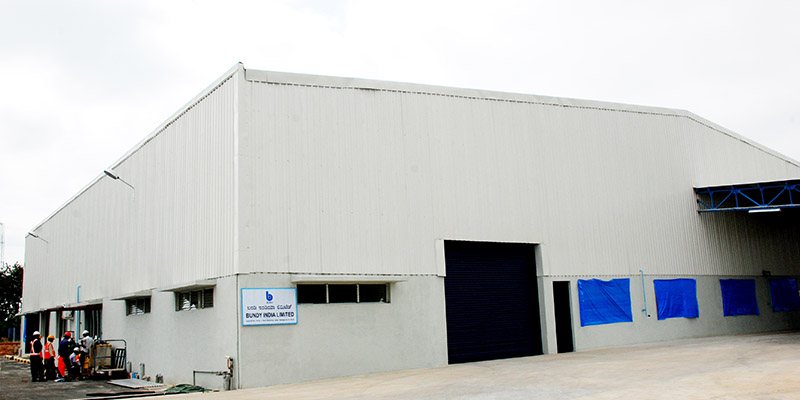
Identify the location of small black door to right. (564, 308).